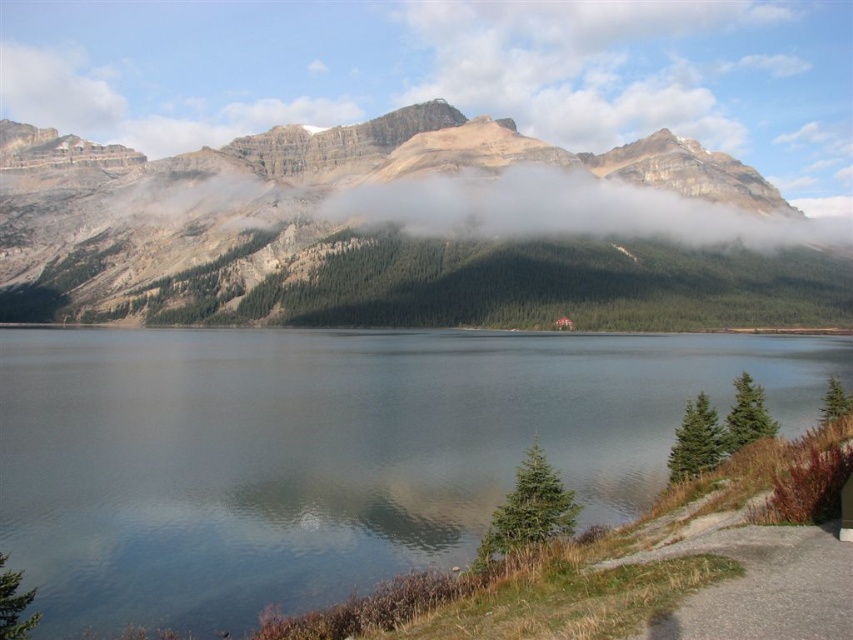
Does clear water at center lie in front of rocky mountain at center?

That is True.

Looking at this image, can you confirm if clear water at center is shorter than rocky mountain at center?

Correct, clear water at center is not as tall as rocky mountain at center.

Between point (328, 408) and point (737, 198), which one is positioned behind?

Positioned behind is point (737, 198).

What are the coordinates of `clear water at center` in the screenshot? It's located at (328, 452).